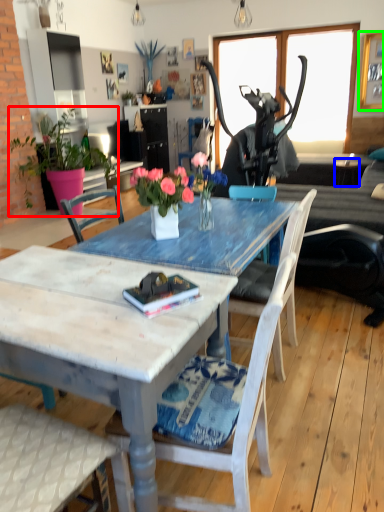
Question: Based on their relative distances, which object is nearer to houseplant (highlighted by a red box)? Choose from side table (highlighted by a blue box) and picture frame (highlighted by a green box).

Choices:
 (A) side table
 (B) picture frame

Answer: (A)